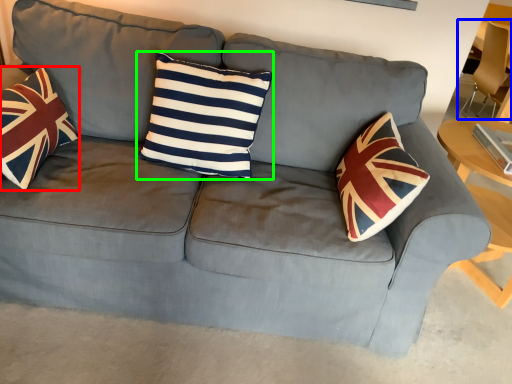
Question: Which object is the closest to the throw pillow (highlighted by a red box)? Choose among these: armchair (highlighted by a blue box) or pillow (highlighted by a green box).

Choices:
 (A) armchair
 (B) pillow

Answer: (B)